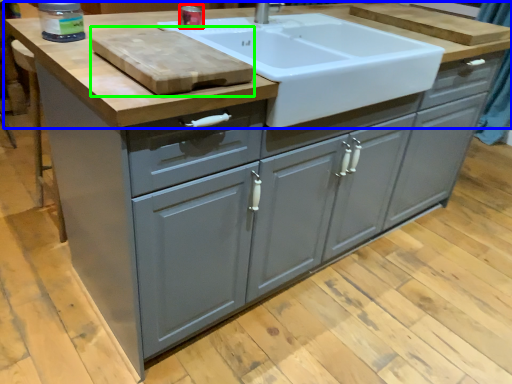
Question: Considering the real-world distances, which object is farthest from appliance (highlighted by a red box)? countertop (highlighted by a blue box) or cutting board (highlighted by a green box)?

Choices:
 (A) countertop
 (B) cutting board

Answer: (B)